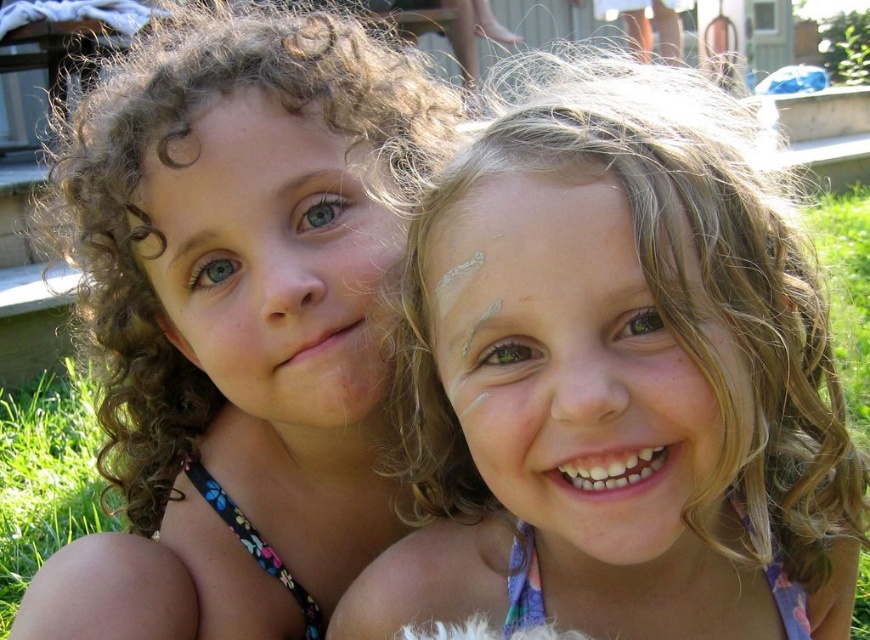
Question: Which point is closer to the camera?

Choices:
 (A) (499, 589)
 (B) (57, 596)
 (C) (2, 627)

Answer: (A)

Question: Observing the image, what is the correct spatial positioning of blonde curly hair at upper right in reference to curly hair at left?

Choices:
 (A) right
 (B) left

Answer: (A)

Question: Does blonde curly hair at upper right lie in front of green grass at lower left?

Choices:
 (A) yes
 (B) no

Answer: (A)

Question: Which point is closer to the camera taking this photo?

Choices:
 (A) (72, 406)
 (B) (532, 522)
 (C) (261, 218)

Answer: (B)

Question: In this image, where is blonde curly hair at upper right located relative to green grass at lower left?

Choices:
 (A) above
 (B) below

Answer: (A)

Question: Which of the following is the farthest from the observer?

Choices:
 (A) (348, 611)
 (B) (8, 500)

Answer: (B)